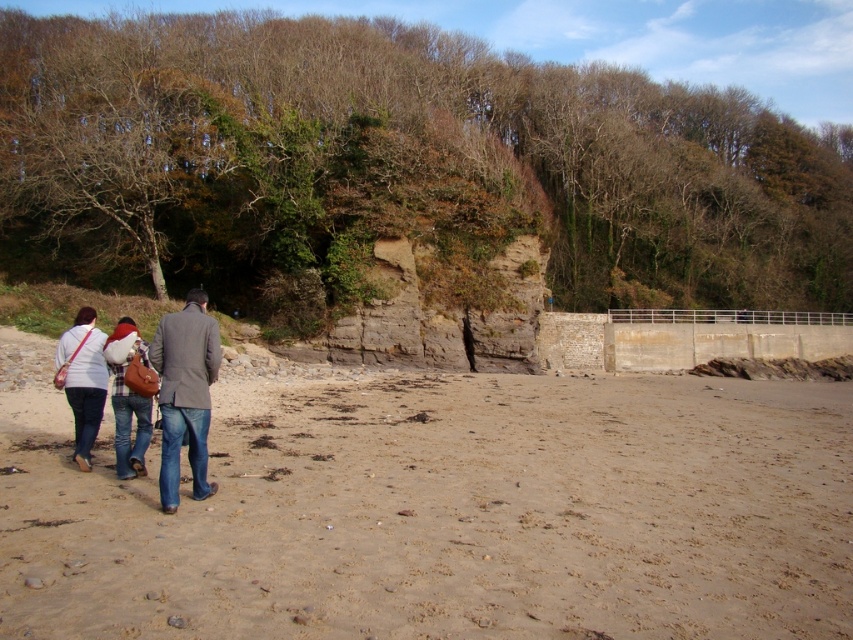
Which is in front, point (666, 566) or point (200, 440)?

Positioned in front is point (666, 566).

The width and height of the screenshot is (853, 640). Find the location of `sandy at left`. sandy at left is located at coordinates (439, 509).

Does brown leafy tree at upper center have a smaller size compared to matte white shirt at lower left?

Actually, brown leafy tree at upper center might be larger than matte white shirt at lower left.

Which is in front, point (252, 102) or point (68, 381)?

Positioned in front is point (68, 381).

Where is `brown leafy tree at upper center`? brown leafy tree at upper center is located at coordinates (398, 164).

Which is more to the right, sandy at left or denim jacket at left?

sandy at left

Does point (674, 412) lie behind point (136, 333)?

That is True.

Where is `sandy at left`? The image size is (853, 640). sandy at left is located at coordinates (439, 509).